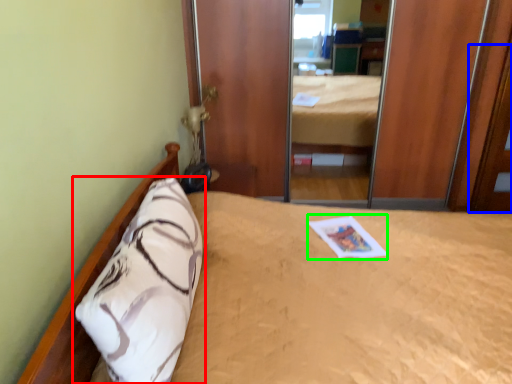
Question: Which object is positioned closest to pillow (highlighted by a red box)? Select from door (highlighted by a blue box) and magazine (highlighted by a green box).

Choices:
 (A) door
 (B) magazine

Answer: (B)